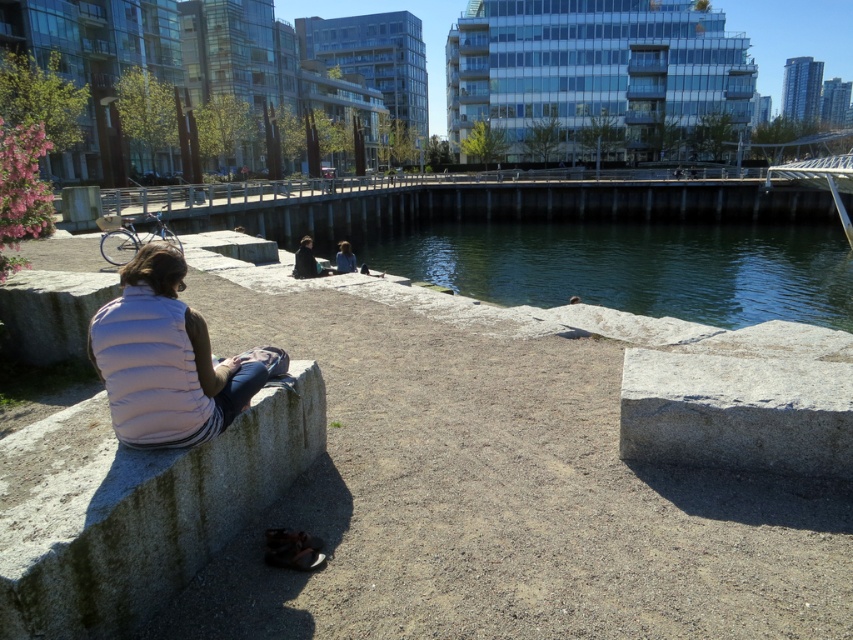
Question: Is gray granite concrete at lower left positioned before light brown hair at center?

Choices:
 (A) yes
 (B) no

Answer: (A)

Question: Is the position of dark brown leather jacket at center less distant than that of light brown hair at center?

Choices:
 (A) yes
 (B) no

Answer: (A)

Question: Can you confirm if gray granite concrete at lower left is positioned to the right of light brown hair at center?

Choices:
 (A) yes
 (B) no

Answer: (A)

Question: Which object is positioned farthest from the white puffy vest at left?

Choices:
 (A) light brown hair at center
 (B) dark brown leather jacket at center

Answer: (A)

Question: Which object is positioned farthest from the gray granite concrete at lower left?

Choices:
 (A) dark brown leather jacket at center
 (B) white puffy vest at left
 (C) light brown hair at center

Answer: (C)

Question: Among these points, which one is farthest from the camera?

Choices:
 (A) (175, 291)
 (B) (341, 248)
 (C) (67, 576)

Answer: (B)